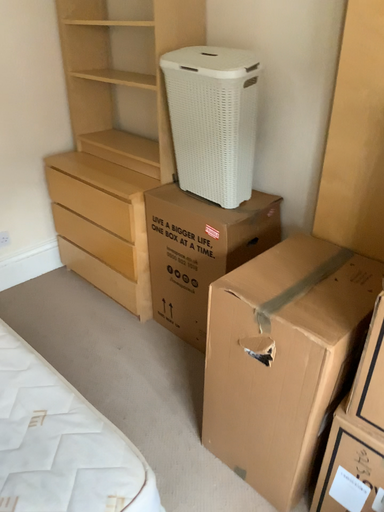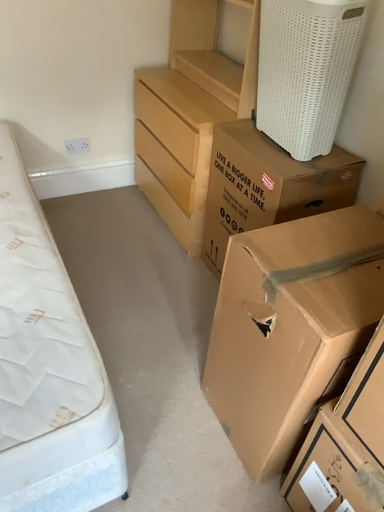
Question: How did the camera likely rotate when shooting the video?

Choices:
 (A) rotated right
 (B) rotated left

Answer: (B)